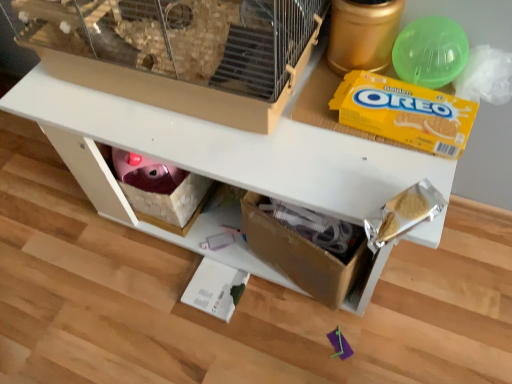
Locate an element on the screen. The height and width of the screenshot is (384, 512). vacant space to the left of white matte table at center is located at coordinates (73, 259).